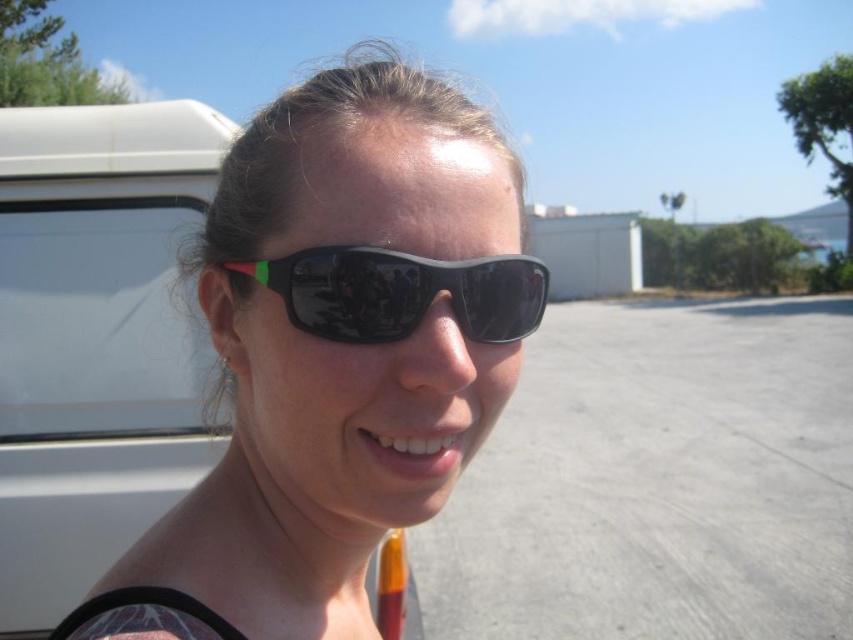
Question: Observing the image, what is the correct spatial positioning of black plastic sunglasses at center in reference to black rubber sunglasses at center?

Choices:
 (A) left
 (B) right

Answer: (A)

Question: Considering the relative positions of black plastic sunglasses at center and black rubber sunglasses at center in the image provided, where is black plastic sunglasses at center located with respect to black rubber sunglasses at center?

Choices:
 (A) below
 (B) above

Answer: (A)

Question: Among these objects, which one is nearest to the camera?

Choices:
 (A) black plastic sunglasses at center
 (B) black rubber sunglasses at center

Answer: (A)

Question: Which of the following is the closest to the observer?

Choices:
 (A) black plastic sunglasses at center
 (B) black rubber sunglasses at center

Answer: (A)

Question: Which point is farther to the camera?

Choices:
 (A) black rubber sunglasses at center
 (B) black plastic sunglasses at center

Answer: (A)

Question: Is black plastic sunglasses at center smaller than black rubber sunglasses at center?

Choices:
 (A) no
 (B) yes

Answer: (A)